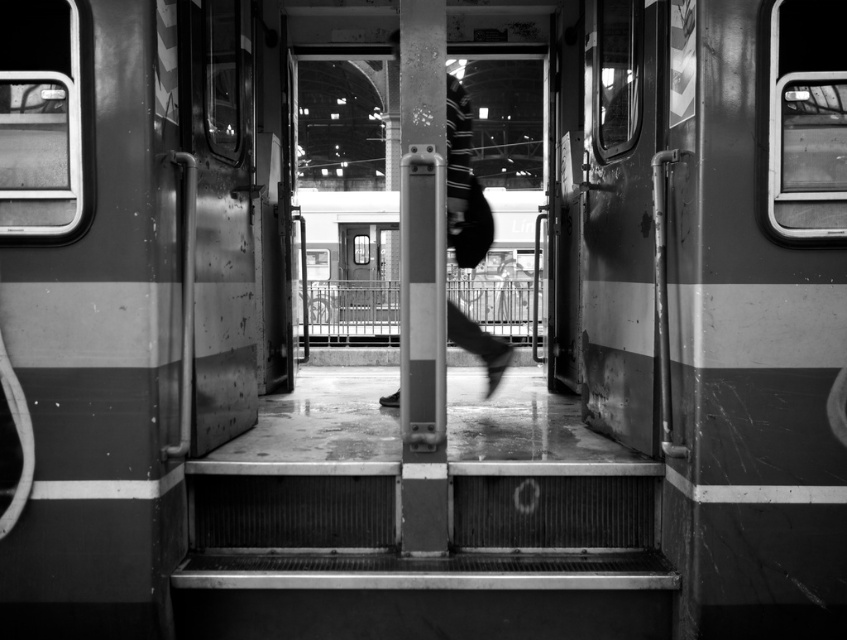
You are a passenger on the train and want to retrieve your black fabric bag at center from the platform. The metallic silver railing at center is in your way. Can you reach the bag without moving the railing?

The black fabric bag at center is behind the metallic silver railing at center, so you cannot reach it without moving the railing.

You are standing on the platform and want to board the train through its open doors. Which direction should you move relative to the metallic silver railing at center to reach the train doors?

To reach the train doors from the metallic silver railing at center, you should move towards the lower level since the railing is located at point (352, 310), which is central but higher up compared to the steps leading down to the platform.

You are a passenger standing on the train platform and want to pick up the black fabric bag at center. The metallic silver railing at center is in your way. Can you reach the bag without moving the railing?

The metallic silver railing at center and black fabric bag at center are 5.23 meters apart, so you can easily reach the bag without moving the railing since they are far apart.